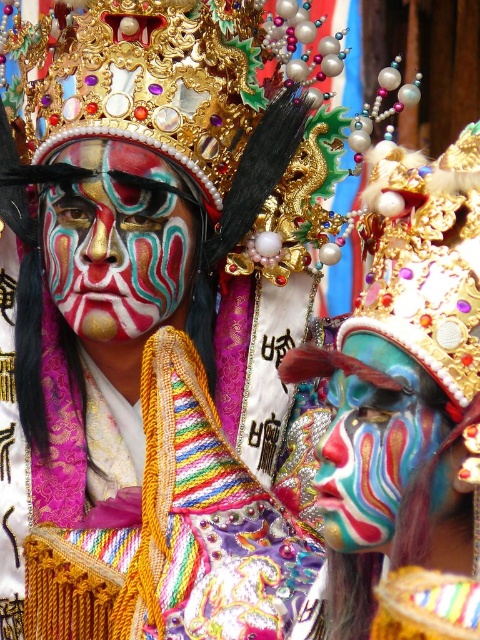
Between matte teal face paint at center and multicolored painted face at center, which one appears on the right side from the viewer's perspective?

From the viewer's perspective, multicolored painted face at center appears more on the right side.

Can you confirm if matte teal face paint at center is thinner than multicolored painted face at center?

No.

Who is more distant from viewer, (x=385, y=548) or (x=373, y=369)?

Point (x=385, y=548)

In order to click on matte teal face paint at center in this screenshot , I will do `click(406, 406)`.

Is matte painted face at center to the right of multicolored painted face at center from the viewer's perspective?

Incorrect, matte painted face at center is not on the right side of multicolored painted face at center.

Is point (144, 272) farther from viewer compared to point (372, 492)?

Yes, point (144, 272) is behind point (372, 492).

The height and width of the screenshot is (640, 480). Identify the location of matte painted face at center. (116, 241).

Can you confirm if matte gold crown at upper center is bigger than matte painted face at center?

Yes, matte gold crown at upper center is bigger than matte painted face at center.

How far apart are matte gold crown at upper center and matte painted face at center?

12.63 feet

I want to click on matte gold crown at upper center, so click(x=158, y=337).